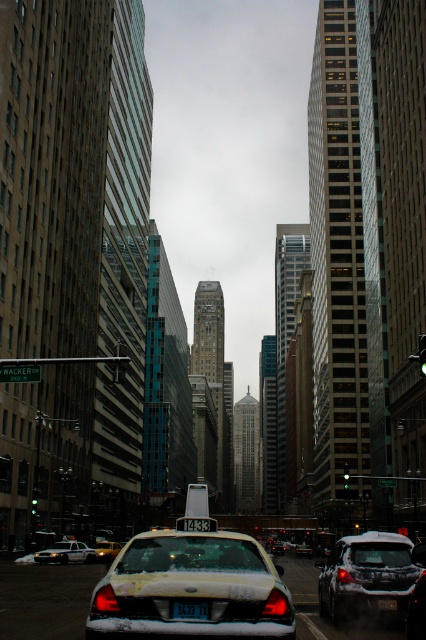
You are a delivery driver who needs to read the license plate at center to confirm the destination. The coordinates given are point (386, 604). Is this point located on the license plate?

Yes, the point (386, 604) is on the white plastic license plate at center, so it is located on the license plate.

You are a delivery driver who needs to read the license plate number on the white plastic license plate at center. Where exactly is the license plate located in the image?

The white plastic license plate at center is located at coordinates point [386,604].